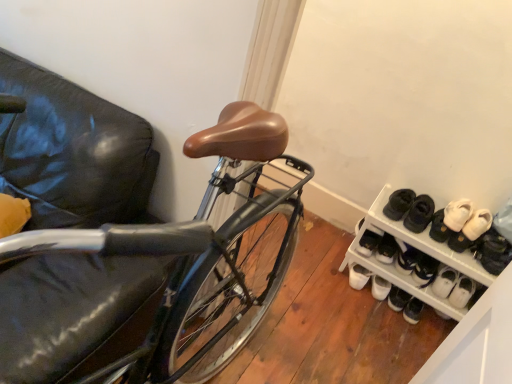
Question: From the image's perspective, relative to white plastic shoe rack at lower right, is white suede sneakers at lower right, the first footwear in the left-to-right sequence, above or below?

Choices:
 (A) above
 (B) below

Answer: (A)

Question: Does point (359, 248) appear closer or farther from the camera than point (450, 334)?

Choices:
 (A) closer
 (B) farther

Answer: (B)

Question: Based on their relative distances, which object is nearer to the white plastic shoe rack at lower right?

Choices:
 (A) white suede shoes at right, which ranks as the 2th footwear in left-to-right order
 (B) white suede sneakers at lower right, acting as the third footwear starting from the left
 (C) white suede sneakers at lower right, the first footwear in the left-to-right sequence
 (D) white suede sneakers at lower right, positioned as the 1th footwear in right-to-left order

Answer: (A)

Question: Which of these objects is positioned farthest from the white suede shoes at right, which is counted as the 3th footwear, starting from the right?

Choices:
 (A) white plastic shoe rack at lower right
 (B) white suede sneakers at lower right, positioned as the 1th footwear in right-to-left order
 (C) white suede sneakers at lower right, the first footwear in the left-to-right sequence
 (D) white suede sneakers at lower right, acting as the third footwear starting from the left

Answer: (C)